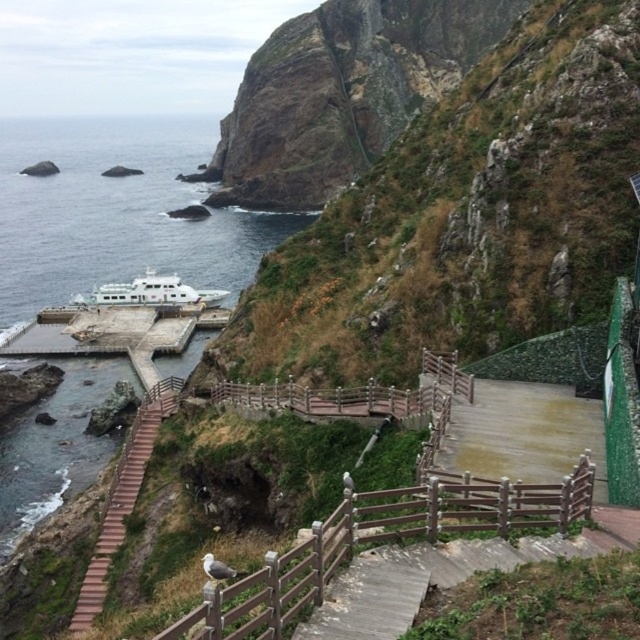
You are standing at the top of the wooden stairs and want to walk down to the ferry boat. As you look down, which object do you see first when facing the stairs? The green mossy rock at center or the brown wooden rail at center?

The brown wooden rail at center is the first object you see when facing the stairs because the green mossy rock at center is positioned to its right, meaning the rail is closer to your line of sight.

You are standing at the top of the wooden stairs and want to place a small flag exactly at the location of the green mossy rock at center. If the stairs are represented as a coordinate system where the top step is at point 0,0 and the bottom step is at 1,1, where should you place the flag?

The green mossy rock at center is located at point (465, 218) in the coordinate system, so you should place the flag at those coordinates.